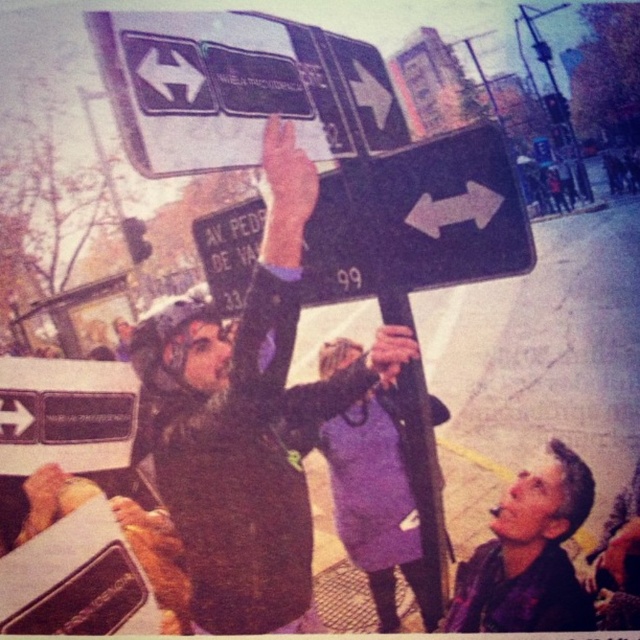
Based on the photo, you are a photographer trying to capture the shiny purple jacket at lower right in your shot. Based on the scene description, where should you position your camera relative to the central group of protesters holding traffic signs to ensure the jacket is in the frame?

The shiny purple jacket at lower right is located at point (529,554), which means it is positioned towards the lower right of the image. To include it in your shot, you should position your camera to the lower right relative to the central group of protesters holding traffic signs so that the jacket remains within the frame.